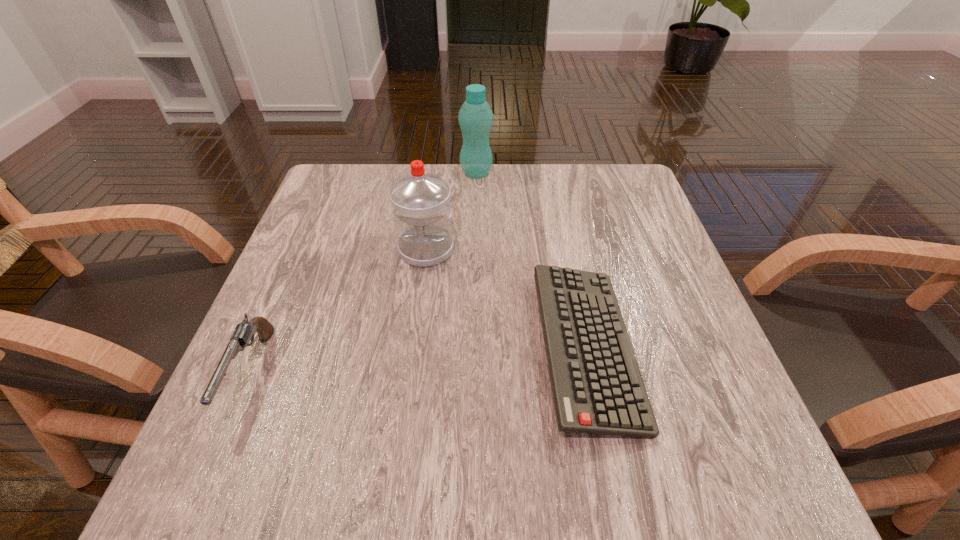
What are the coordinates of `free space that is in between the shortest object and the leftmost object` in the screenshot? It's located at (419, 360).

I want to click on the second closest object relative to the third object from right to left, so click(475, 117).

The width and height of the screenshot is (960, 540). I want to click on object that is the third closest to the gun, so click(475, 117).